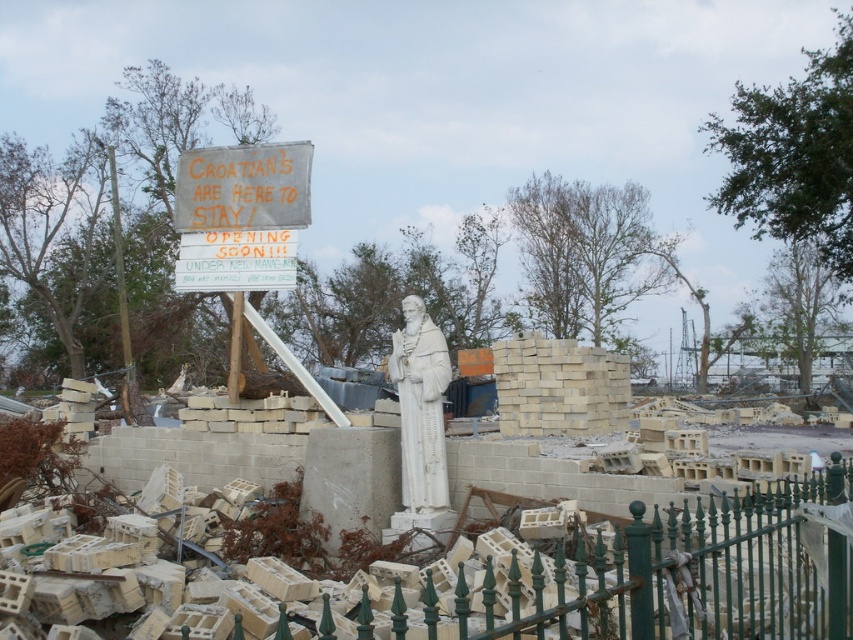
You are standing at the statue of the saint in the scene. You see a green wrought iron fence at center marked by point [643,576]. If you walk straight ahead from the statue, will you reach the green wrought iron fence at center before the debris field?

The green wrought iron fence at center is represented by point [643,576], so yes, walking straight ahead from the statue, you will reach the green wrought iron fence at center before the debris field.

You are a delivery person who needs to place a large box between the white concrete statue at center and the wooden sign at upper center. The box is 1.2 meters wide. Can you fit the box between them?

The white concrete statue at center might be wider than wooden sign at upper center, so the distance between them is uncertain. Without knowing the exact width of the statue and the sign, it is impossible to determine if the 1.2 meter wide box can fit between them.